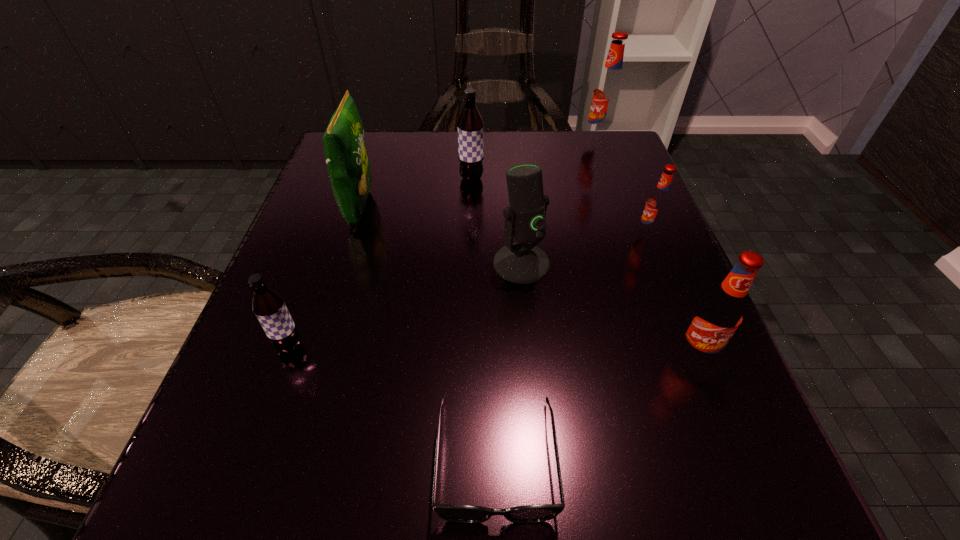
Locate an element on the screen. The height and width of the screenshot is (540, 960). free space between the biggest red root beer and the bigger brown root beer is located at coordinates (535, 160).

Identify the location of free spot between the crisp (potato chip) and the second root beer from left to right. (416, 193).

At what (x,y) coordinates should I click in order to perform the action: click on object that stands as the closest to the second farthest object. Please return your answer as a coordinate pair (x, y). Looking at the image, I should click on (348, 165).

Select which object is the seventh closest to the farthest red root beer. Please provide its 2D coordinates. Your answer should be formatted as a tuple, i.e. [(x, y)], where the tuple contains the x and y coordinates of a point satisfying the conditions above.

[(269, 307)]

Identify which root beer is located as the third nearest to the crisp (potato chip). Please provide its 2D coordinates. Your answer should be formatted as a tuple, i.e. [(x, y)], where the tuple contains the x and y coordinates of a point satisfying the conditions above.

[(608, 92)]

Select which root beer is the closest to the third nearest root beer. Please provide its 2D coordinates. Your answer should be formatted as a tuple, i.e. [(x, y)], where the tuple contains the x and y coordinates of a point satisfying the conditions above.

[(719, 314)]

Locate which red root beer is the closest to the crisp (potato chip). Please provide its 2D coordinates. Your answer should be formatted as a tuple, i.e. [(x, y)], where the tuple contains the x and y coordinates of a point satisfying the conditions above.

[(608, 92)]

Point out which red root beer is positioned as the nearest to the farthest object. Please provide its 2D coordinates. Your answer should be formatted as a tuple, i.e. [(x, y)], where the tuple contains the x and y coordinates of a point satisfying the conditions above.

[(658, 203)]

The width and height of the screenshot is (960, 540). I want to click on free space that satisfies the following two spatial constraints: 1. on the front-facing side of the green crisp (potato chip); 2. on the back side of the microphone, so click(x=343, y=264).

Image resolution: width=960 pixels, height=540 pixels. Identify the location of blank area in the image that satisfies the following two spatial constraints: 1. on the front-facing side of the second biggest red root beer; 2. on the right side of the green crisp (potato chip). (315, 354).